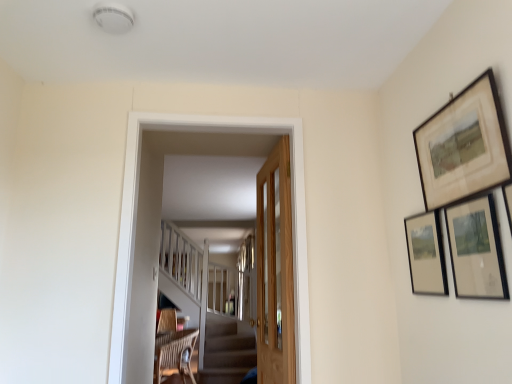
Describe the element at coordinates (136, 213) in the screenshot. The image size is (512, 384). I see `wooden door at center` at that location.

The height and width of the screenshot is (384, 512). Describe the element at coordinates (426, 254) in the screenshot. I see `wooden-framed picture at upper right, arranged as the 3th picture frame when viewed from the top` at that location.

Measure the distance between point (431, 163) and camera.

Point (431, 163) and camera are 5.35 feet apart.

What do you see at coordinates (275, 270) in the screenshot? I see `wooden door at center` at bounding box center [275, 270].

Identify the location of wooden door at center. (136, 213).

Considering the relative positions of wooden door at center and wooden door at center in the image provided, is wooden door at center behind wooden door at center?

No, it is not.

Can we say wooden door at center lies outside wooden door at center?

That's correct, wooden door at center is outside of wooden door at center.

Which is behind, matte black picture frame at right, which is the second picture frame from bottom to top, or wooden-framed picture at upper right, which ranks as the first picture frame in bottom-to-top order?

wooden-framed picture at upper right, which ranks as the first picture frame in bottom-to-top order.

Is matte black picture frame at right, arranged as the 2th picture frame when viewed from the top, touching wooden-framed picture at upper right, arranged as the 3th picture frame when viewed from the top?

matte black picture frame at right, arranged as the 2th picture frame when viewed from the top, and wooden-framed picture at upper right, arranged as the 3th picture frame when viewed from the top, are not in contact.

Is matte black picture frame at right, arranged as the 2th picture frame when viewed from the top, oriented towards wooden-framed picture at upper right, which ranks as the first picture frame in bottom-to-top order?

No, matte black picture frame at right, arranged as the 2th picture frame when viewed from the top, does not turn towards wooden-framed picture at upper right, which ranks as the first picture frame in bottom-to-top order.

Does wooden door at center have a smaller size compared to wooden-framed picture at upper right, arranged as the 3th picture frame when viewed from the top?

Actually, wooden door at center might be larger than wooden-framed picture at upper right, arranged as the 3th picture frame when viewed from the top.

Does wooden door at center appear on the right side of wooden-framed picture at upper right, arranged as the 3th picture frame when viewed from the top?

No.

From a real-world perspective, who is located lower, wooden door at center or wooden-framed picture at upper right, which ranks as the first picture frame in bottom-to-top order?

In real-world perspective, wooden-framed picture at upper right, which ranks as the first picture frame in bottom-to-top order, is lower.

Choose the correct answer: Is wooden door at center inside wooden-framed picture at upper right, which ranks as the first picture frame in bottom-to-top order, or outside it?

wooden door at center is not enclosed by wooden-framed picture at upper right, which ranks as the first picture frame in bottom-to-top order.

Is wooden-framed artwork at upper right, the first picture frame when ordered from top to bottom, looking in the opposite direction of wooden-framed picture at upper right, which ranks as the first picture frame in bottom-to-top order?

That's not correct — wooden-framed artwork at upper right, the first picture frame when ordered from top to bottom, is not looking away from wooden-framed picture at upper right, which ranks as the first picture frame in bottom-to-top order.

Is there a large distance between wooden-framed artwork at upper right, which is counted as the third picture frame, starting from the bottom, and wooden-framed picture at upper right, arranged as the 3th picture frame when viewed from the top?

No, there isn't a large distance between wooden-framed artwork at upper right, which is counted as the third picture frame, starting from the bottom, and wooden-framed picture at upper right, arranged as the 3th picture frame when viewed from the top.

Is wooden-framed artwork at upper right, which is counted as the third picture frame, starting from the bottom, not within wooden-framed picture at upper right, arranged as the 3th picture frame when viewed from the top?

Yes, wooden-framed artwork at upper right, which is counted as the third picture frame, starting from the bottom, is located beyond the bounds of wooden-framed picture at upper right, arranged as the 3th picture frame when viewed from the top.

Between wooden-framed picture at upper right, arranged as the 3th picture frame when viewed from the top, and wooden door at center, which one has more height?

Standing taller between the two is wooden door at center.

Considering the positions of objects wooden-framed picture at upper right, which ranks as the first picture frame in bottom-to-top order, and wooden door at center in the image provided, who is behind, wooden-framed picture at upper right, which ranks as the first picture frame in bottom-to-top order, or wooden door at center?

wooden door at center is more distant.

Does wooden-framed picture at upper right, which ranks as the first picture frame in bottom-to-top order, have a smaller size compared to wooden door at center?

Indeed, wooden-framed picture at upper right, which ranks as the first picture frame in bottom-to-top order, has a smaller size compared to wooden door at center.

From a real-world perspective, is wooden-framed picture at upper right, which ranks as the first picture frame in bottom-to-top order, below wooden door at center?

Actually, wooden-framed picture at upper right, which ranks as the first picture frame in bottom-to-top order, is physically above wooden door at center in the real world.

What's the angular difference between wooden-framed picture at upper right, arranged as the 3th picture frame when viewed from the top, and matte black picture frame at right, arranged as the 2th picture frame when viewed from the top,'s facing directions?

The facing directions of wooden-framed picture at upper right, arranged as the 3th picture frame when viewed from the top, and matte black picture frame at right, arranged as the 2th picture frame when viewed from the top, are 1.48 degrees apart.

Could you tell me if wooden-framed picture at upper right, arranged as the 3th picture frame when viewed from the top, is facing matte black picture frame at right, arranged as the 2th picture frame when viewed from the top?

No.

From the picture: Between wooden-framed picture at upper right, which ranks as the first picture frame in bottom-to-top order, and matte black picture frame at right, which is the second picture frame from bottom to top, which one has less height?

matte black picture frame at right, which is the second picture frame from bottom to top.

Is wooden-framed picture at upper right, which ranks as the first picture frame in bottom-to-top order, bigger than matte black picture frame at right, arranged as the 2th picture frame when viewed from the top?

No.

Considering their positions, is wooden door at center located in front of or behind matte black picture frame at right, arranged as the 2th picture frame when viewed from the top?

Clearly, wooden door at center is behind matte black picture frame at right, arranged as the 2th picture frame when viewed from the top.

From the image's perspective, is wooden door at center beneath matte black picture frame at right, arranged as the 2th picture frame when viewed from the top?

Yes, from the image's perspective, wooden door at center is beneath matte black picture frame at right, arranged as the 2th picture frame when viewed from the top.

Is wooden door at center not inside matte black picture frame at right, which is the second picture frame from bottom to top?

Indeed, wooden door at center is completely outside matte black picture frame at right, which is the second picture frame from bottom to top.

Is matte black picture frame at right, arranged as the 2th picture frame when viewed from the top, at the back of wooden door at center?

No, wooden door at center's orientation is not away from matte black picture frame at right, arranged as the 2th picture frame when viewed from the top.

The image size is (512, 384). I want to click on corridor above the wooden door at center (from the image's perspective), so click(136, 213).

Find the location of `picture frame that is below the matte black picture frame at right, arranged as the 2th picture frame when viewed from the top (from the image's perspective)`. picture frame that is below the matte black picture frame at right, arranged as the 2th picture frame when viewed from the top (from the image's perspective) is located at coordinates (426, 254).

Considering their positions, is wooden door at center positioned further to wooden door at center than matte black picture frame at right, arranged as the 2th picture frame when viewed from the top?

matte black picture frame at right, arranged as the 2th picture frame when viewed from the top.

From the image, which object appears to be farther from wooden-framed artwork at upper right, the first picture frame when ordered from top to bottom, wooden door at center or wooden-framed picture at upper right, which ranks as the first picture frame in bottom-to-top order?

wooden door at center lies further to wooden-framed artwork at upper right, the first picture frame when ordered from top to bottom, than the other object.

From the image, which object appears to be farther from wooden door at center, wooden-framed picture at upper right, arranged as the 3th picture frame when viewed from the top, or wooden-framed artwork at upper right, the first picture frame when ordered from top to bottom?

Among the two, wooden-framed artwork at upper right, the first picture frame when ordered from top to bottom, is located further to wooden door at center.

Which object lies further to the anchor point wooden-framed artwork at upper right, which is counted as the third picture frame, starting from the bottom, wooden-framed picture at upper right, which ranks as the first picture frame in bottom-to-top order, or matte black picture frame at right, which is the second picture frame from bottom to top?

Based on the image, wooden-framed picture at upper right, which ranks as the first picture frame in bottom-to-top order, appears to be further to wooden-framed artwork at upper right, which is counted as the third picture frame, starting from the bottom.

Looking at this image, based on their spatial positions, is matte black picture frame at right, which is the second picture frame from bottom to top, or wooden-framed picture at upper right, which ranks as the first picture frame in bottom-to-top order, closer to wooden door at center?

Based on the image, wooden-framed picture at upper right, which ranks as the first picture frame in bottom-to-top order, appears to be nearer to wooden door at center.

When comparing their distances from wooden door at center, does wooden-framed picture at upper right, which ranks as the first picture frame in bottom-to-top order, or wooden door at center seem closer?

wooden door at center lies closer to wooden door at center than the other object.

Looking at this image, from the image, which object appears to be nearer to matte black picture frame at right, arranged as the 2th picture frame when viewed from the top, wooden-framed picture at upper right, which ranks as the first picture frame in bottom-to-top order, or wooden door at center?

wooden-framed picture at upper right, which ranks as the first picture frame in bottom-to-top order, is positioned closer to the anchor matte black picture frame at right, arranged as the 2th picture frame when viewed from the top.

From the image, which object appears to be nearer to wooden-framed artwork at upper right, the first picture frame when ordered from top to bottom, matte black picture frame at right, arranged as the 2th picture frame when viewed from the top, or wooden door at center?

The object closer to wooden-framed artwork at upper right, the first picture frame when ordered from top to bottom, is matte black picture frame at right, arranged as the 2th picture frame when viewed from the top.

Identify the location of picture frame between matte black picture frame at right, which is the second picture frame from bottom to top, and wooden door at center from front to back. (426, 254).

Locate an element on the screen. The image size is (512, 384). picture frame between wooden-framed artwork at upper right, the first picture frame when ordered from top to bottom, and wooden-framed picture at upper right, arranged as the 3th picture frame when viewed from the top, vertically is located at coordinates (476, 249).

Find the location of a particular element. The width and height of the screenshot is (512, 384). door located between wooden door at center and wooden-framed artwork at upper right, the first picture frame when ordered from top to bottom, in the left-right direction is located at coordinates (275, 270).

What are the coordinates of `door between wooden door at center and matte black picture frame at right, arranged as the 2th picture frame when viewed from the top, in the horizontal direction` in the screenshot? It's located at (275, 270).